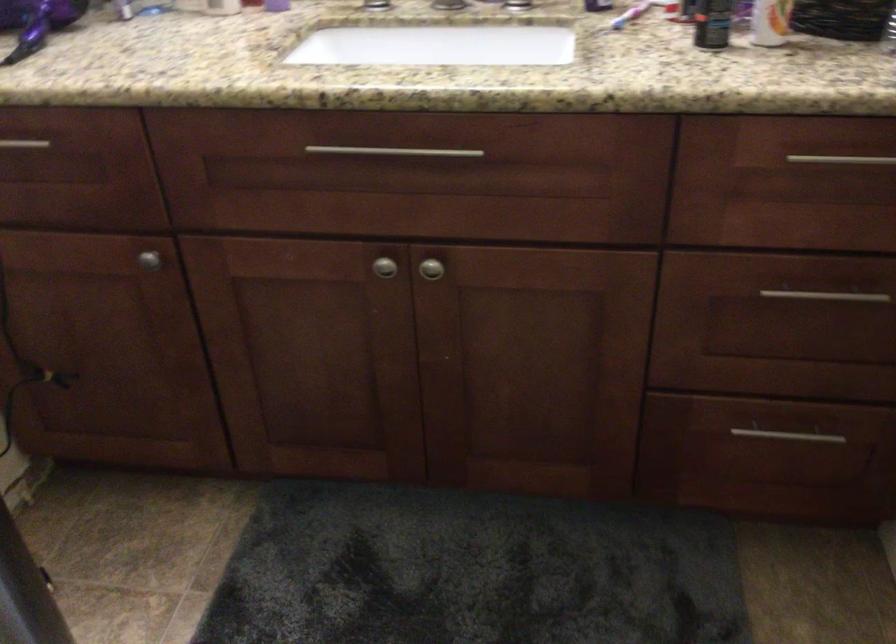
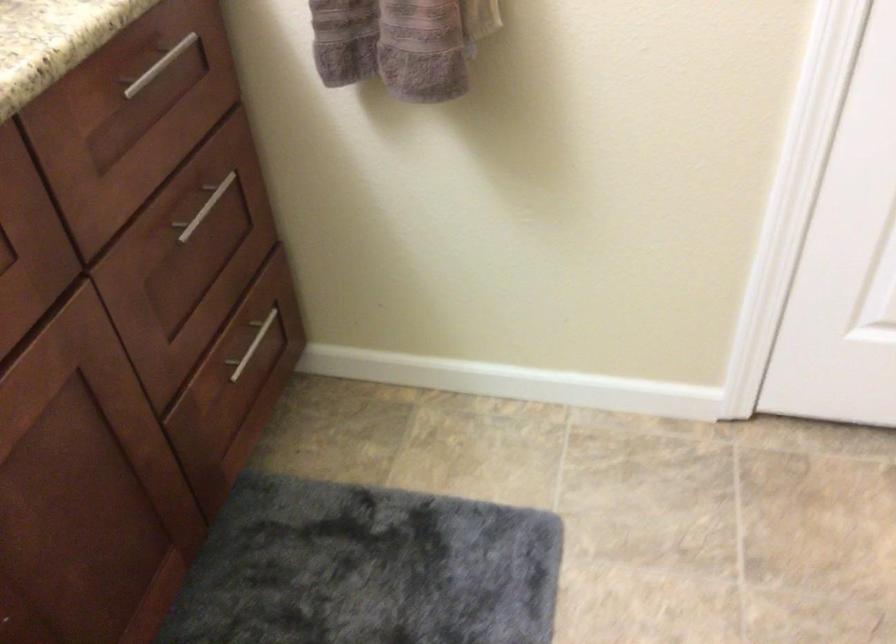
The point at [787,431] is marked in the first image. Where is the corresponding point in the second image?

(252, 345)